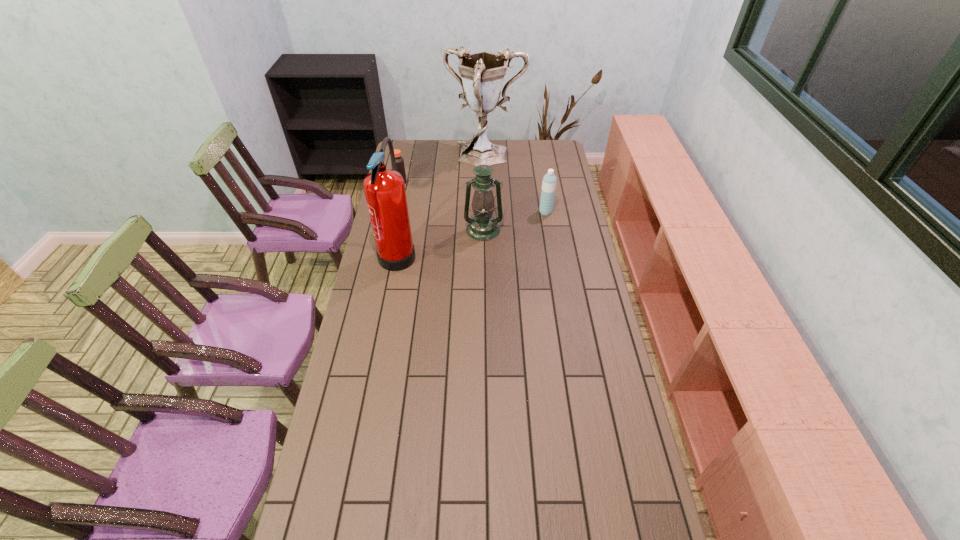
This screenshot has width=960, height=540. Identify the location of trophy cup. (482, 73).

Image resolution: width=960 pixels, height=540 pixels. In order to click on fire extinguisher in this screenshot , I will do `click(384, 189)`.

Locate an element on the screen. The width and height of the screenshot is (960, 540). oil lamp is located at coordinates (483, 227).

Find the location of `water bottle`. water bottle is located at coordinates (549, 181).

Image resolution: width=960 pixels, height=540 pixels. What are the coordinates of `the fourth tallest object` in the screenshot? It's located at (549, 181).

The image size is (960, 540). What are the coordinates of `the shortest object` in the screenshot? It's located at (400, 167).

Locate an element on the screen. the fourth nearest object is located at coordinates (400, 167).

Where is `vacant space located 0.090m on the right of the trophy cup`? This screenshot has width=960, height=540. vacant space located 0.090m on the right of the trophy cup is located at coordinates (540, 158).

Image resolution: width=960 pixels, height=540 pixels. What are the coordinates of `vacant space located 0.050m on the back of the fire extinguisher` in the screenshot? It's located at (405, 217).

This screenshot has height=540, width=960. In order to click on vacant point located on the back of the third shortest object in this screenshot , I will do `click(483, 182)`.